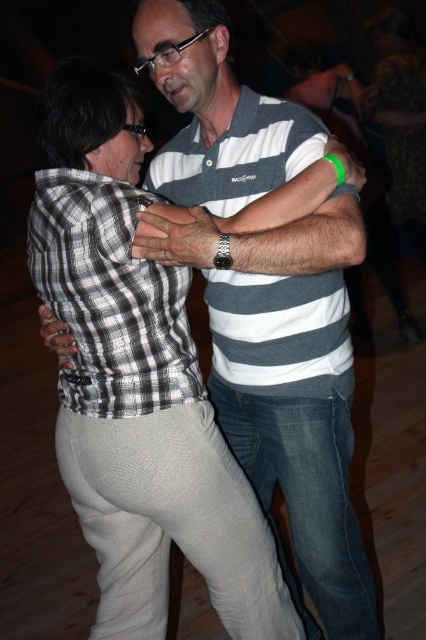
In the scene shown: Is gray striped polo shirt at center positioned behind checkered fabric shirt at center?

No.

Who is lower down, gray striped polo shirt at center or checkered fabric shirt at center?

Positioned lower is checkered fabric shirt at center.

What do you see at coordinates (281, 332) in the screenshot? I see `gray striped polo shirt at center` at bounding box center [281, 332].

This screenshot has height=640, width=426. I want to click on gray striped polo shirt at center, so click(281, 332).